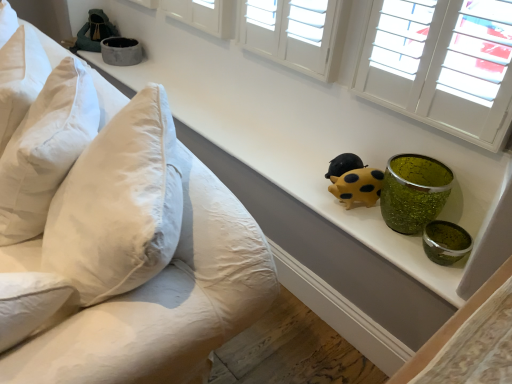
Question: In the image, is white cotton pillow at left, marked as the first pillow in a bottom-to-top arrangement, on the left side or the right side of yellow matte pig at center, the first toy when ordered from front to back?

Choices:
 (A) left
 (B) right

Answer: (A)

Question: From the image's perspective, is white cotton pillow at left, marked as the first pillow in a bottom-to-top arrangement, positioned above or below yellow matte pig at center, the first toy when ordered from front to back?

Choices:
 (A) above
 (B) below

Answer: (A)

Question: Which object is positioned farthest from the velvet green bag at upper left, which is the 1th toy in back-to-front order?

Choices:
 (A) white soft pillow at upper left, positioned as the 1th pillow in top-to-bottom order
 (B) white cotton pillow at left, marked as the first pillow in a bottom-to-top arrangement
 (C) yellow matte pig at center, which is counted as the 2th toy, starting from the left
 (D) white cotton pillows at left
 (E) matte gray bowl at upper left

Answer: (C)

Question: Which object is positioned closest to the white cotton pillows at left?

Choices:
 (A) white soft pillow at upper left, which is the 2th pillow from bottom to top
 (B) velvet green bag at upper left, positioned as the 2th toy in bottom-to-top order
 (C) matte gray bowl at upper left
 (D) white cotton pillow at left, marked as the first pillow in a bottom-to-top arrangement
 (E) yellow matte pig at center, positioned as the first toy in right-to-left order

Answer: (D)